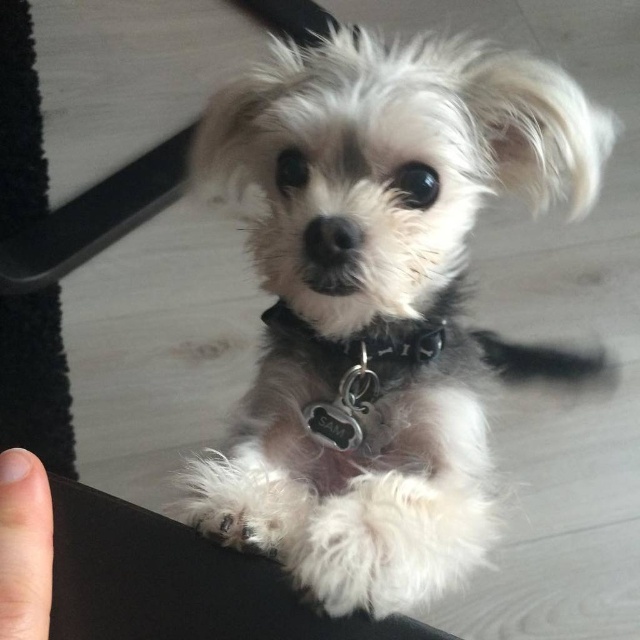
You are a robotic assistant that needs to pick up an object. You see the white fluffy dog at center and the smooth skin finger at lower left. Which object is closer to you?

The smooth skin finger at lower left is closer to you since it is only 38.78 centimeters away from the white fluffy dog at center, implying that the finger is nearer to the robotic assistant.

You are standing in the room where the image is taken. There is a point marked at coordinates [380,300]. What object is located at that point?

The white fluffy dog at center is located at point [380,300].

You are a dog trainer observing SAM the dog. You notice a finger pointing at SAM and the collar. From SAMs perspective, which object is closer to him, the smooth skin finger at lower left or the black leather collar at center?

The smooth skin finger at lower left is in front of the black leather collar at center, so from SAMs perspective, the smooth skin finger at lower left is closer to him.